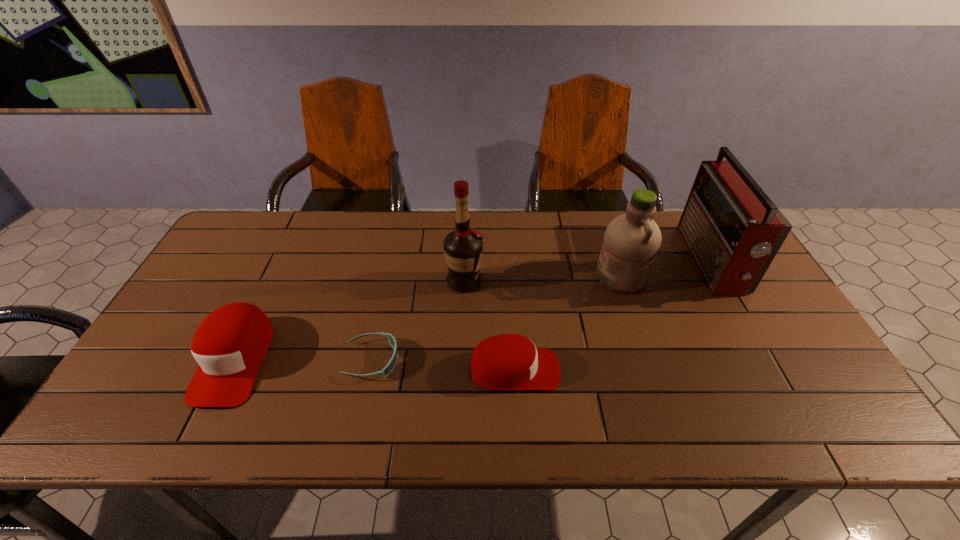
The height and width of the screenshot is (540, 960). I want to click on the left baseball cap, so click(x=230, y=344).

Where is `the leftmost object`? This screenshot has width=960, height=540. the leftmost object is located at coordinates (230, 344).

Identify the location of the second shortest object. (506, 362).

Locate an element on the screen. This screenshot has width=960, height=540. the shorter baseball cap is located at coordinates (506, 362).

Image resolution: width=960 pixels, height=540 pixels. What are the coordinates of `the rightmost object` in the screenshot? It's located at (733, 230).

Locate an element on the screen. The height and width of the screenshot is (540, 960). liquor is located at coordinates (463, 247).

Where is `the second object from right to left`? This screenshot has height=540, width=960. the second object from right to left is located at coordinates (631, 243).

Locate an element on the screen. The width and height of the screenshot is (960, 540). goggles is located at coordinates (388, 368).

I want to click on the shortest object, so click(388, 368).

Where is `free space located 0.310m on the front-facing side of the shorter baseball cap`? The image size is (960, 540). free space located 0.310m on the front-facing side of the shorter baseball cap is located at coordinates click(x=687, y=370).